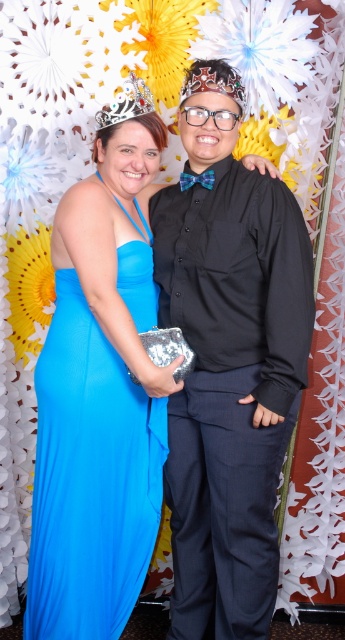
Is matte black shirt at center to the right of matte blue dress at left from the viewer's perspective?

Indeed, matte black shirt at center is positioned on the right side of matte blue dress at left.

Who is positioned more to the left, matte black shirt at center or matte blue dress at left?

matte blue dress at left is more to the left.

Does point (196, 163) lie behind point (96, 422)?

Yes, point (196, 163) is behind point (96, 422).

What are the coordinates of `matte black shirt at center` in the screenshot? It's located at (229, 369).

Between matte blue dress at left and silver metallic crown at upper center, which one appears on the right side from the viewer's perspective?

Positioned to the right is silver metallic crown at upper center.

Consider the image. Between matte blue dress at left and silver metallic crown at upper center, which one has more height?

Standing taller between the two is matte blue dress at left.

What do you see at coordinates (90, 480) in the screenshot? I see `matte blue dress at left` at bounding box center [90, 480].

Image resolution: width=345 pixels, height=640 pixels. What are the coordinates of `matte blue dress at left` in the screenshot? It's located at (90, 480).

Can you confirm if matte black shirt at center is shorter than silver metallic crown at upper center?

Incorrect, matte black shirt at center's height does not fall short of silver metallic crown at upper center's.

Looking at this image, is matte black shirt at center below silver metallic crown at upper center?

Yes.

Where is `matte black shirt at center`? matte black shirt at center is located at coordinates (229, 369).

I want to click on matte black shirt at center, so click(229, 369).